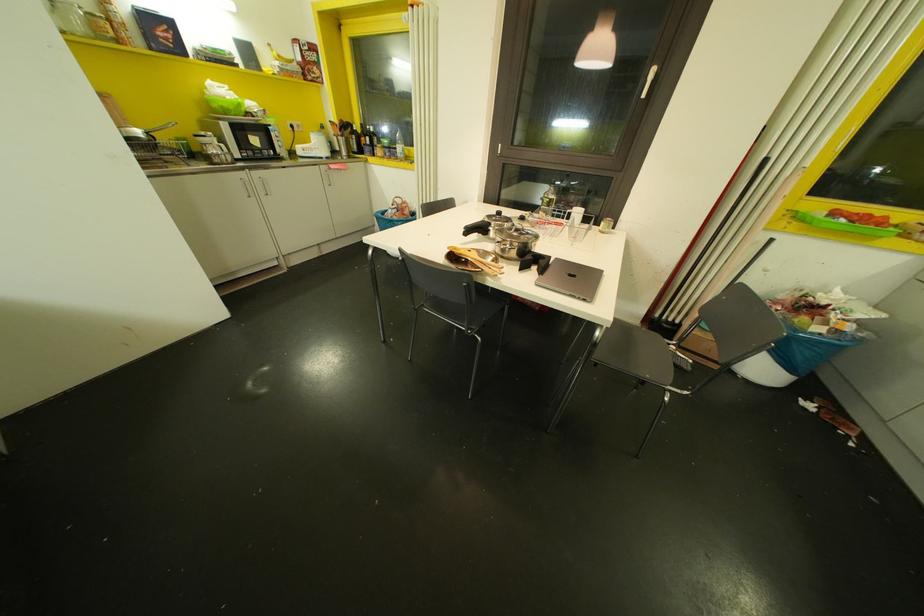
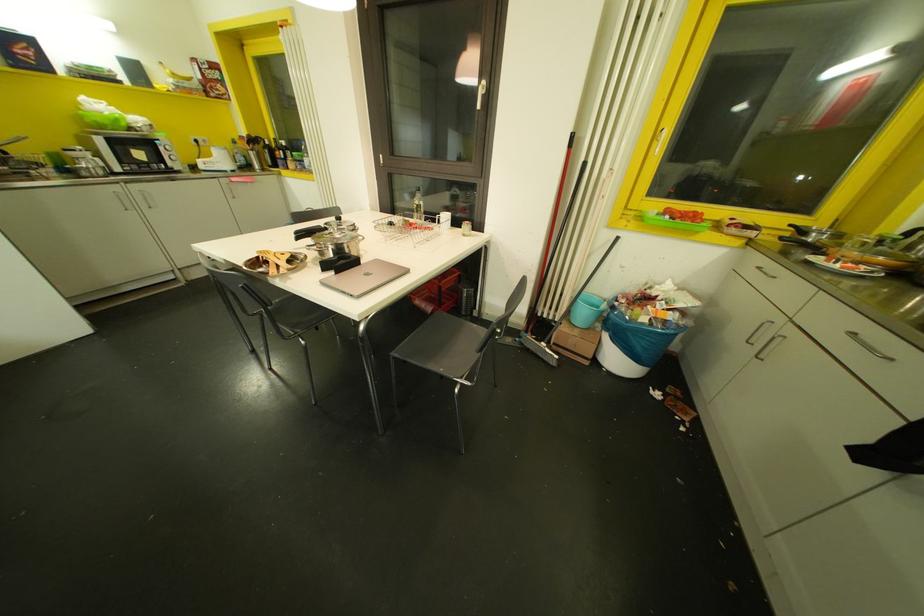
Question: The images are taken continuously from a first-person perspective. In which direction are you moving?

Choices:
 (A) Left
 (B) Right
 (C) Forward
 (D) Backward

Answer: (B)